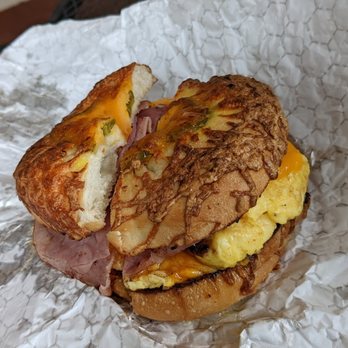
You are a GUI agent. You are given a task and a screenshot of the screen. Output one action in this format:
    pyautogui.click(x=<x>, y=<y>)
    Task: Click on the dark tabletop background
    This screenshot has height=348, width=348.
    Given the screenshot: What is the action you would take?
    pyautogui.click(x=18, y=19)